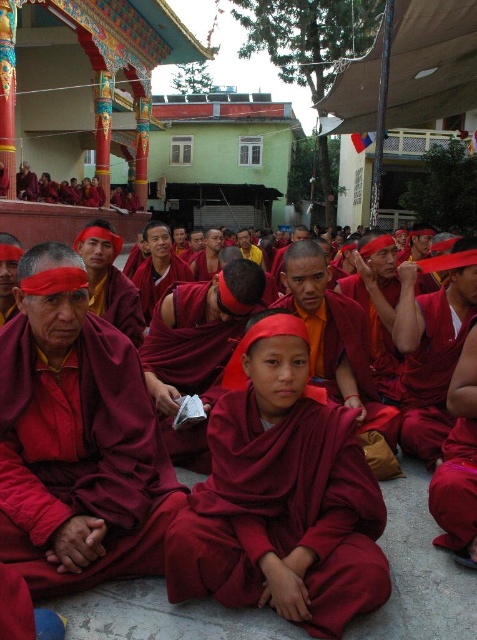
You are a visitor standing at the entrance of the temple complex and see the maroon cotton robe at center and the matte red robe at center. If you want to visit both robes, which one should you approach first to minimize the distance you walk?

Both robes are at the center, so you can approach either one first since they are at the same central location.

You are a visitor in the temple complex and want to know if the two robes at the center are close enough to be part of the same group. The temple requires that robes in the same group must be within 20 feet of each other. Can the matte maroon robe at center and the maroon cotton robe at center be considered part of the same group?

The distance between the matte maroon robe at center and the maroon cotton robe at center is 18.49 feet, which is less than the 20 feet requirement. Therefore, they can be considered part of the same group.